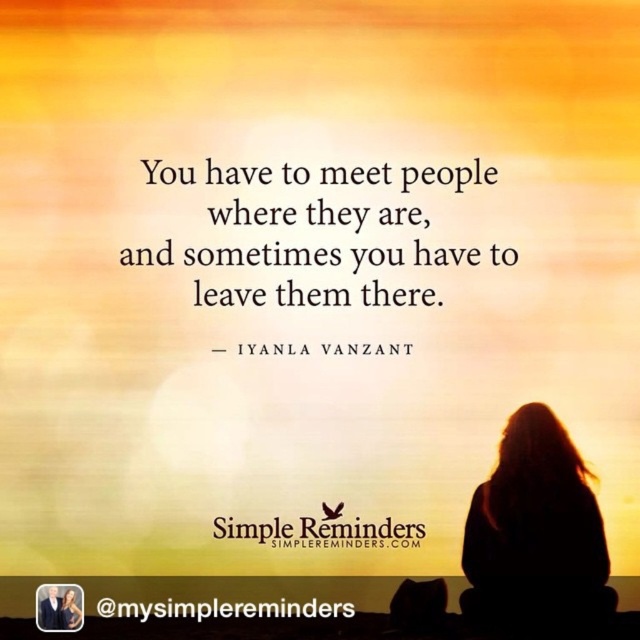
Which is above, silhouette hair at right or goldmetallictext at upper center?

silhouette hair at right is above.

Which is in front, point (564, 589) or point (362, 522)?

Point (564, 589) is more forward.

Which is behind, point (532, 472) or point (228, 516)?

The point (532, 472) is behind.

Locate an element on the screen. Image resolution: width=640 pixels, height=640 pixels. silhouette hair at right is located at coordinates (536, 532).

Between black text at center and black suit at lower left, which one has less height?

Standing shorter between the two is black text at center.

Between black text at center and black suit at lower left, which one is positioned higher?

Positioned higher is black text at center.

Who is more distant from viewer, [340,609] or [44,596]?

Positioned behind is point [44,596].

This screenshot has height=640, width=640. Find the location of `black text at center`. black text at center is located at coordinates [x=224, y=609].

Between point (278, 532) and point (60, 625), which one is positioned in front?

Point (278, 532) is more forward.

Can you confirm if goldmetallictext at upper center is smaller than black suit at lower left?

Actually, goldmetallictext at upper center might be larger than black suit at lower left.

Is point (230, 524) closer to viewer compared to point (45, 595)?

Yes.

You are a GUI agent. You are given a task and a screenshot of the screen. Output one action in this format:
    pyautogui.click(x=<x>, y=<y>)
    Task: Click on the goldmetallictext at upper center
    The image size is (640, 640).
    Given the screenshot: What is the action you would take?
    pos(321,531)